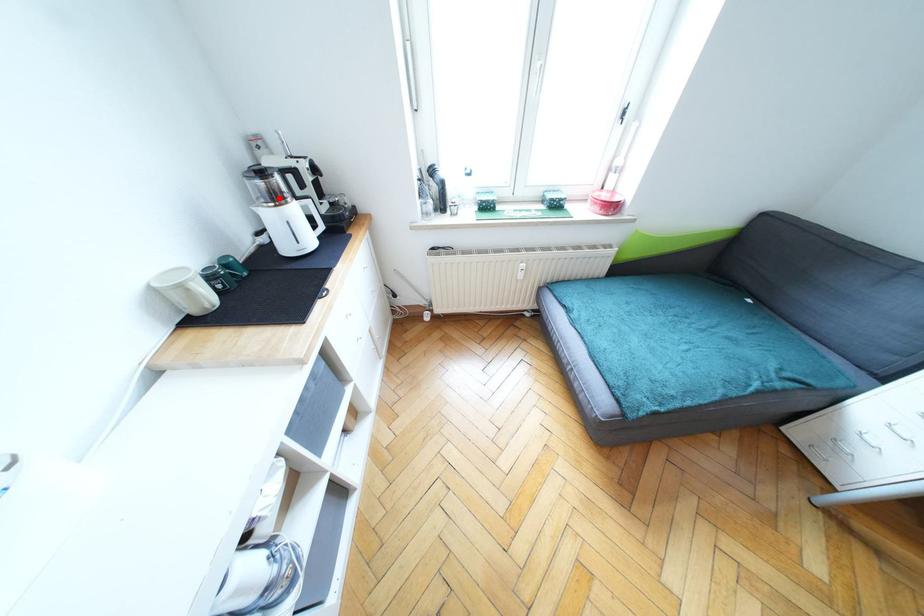
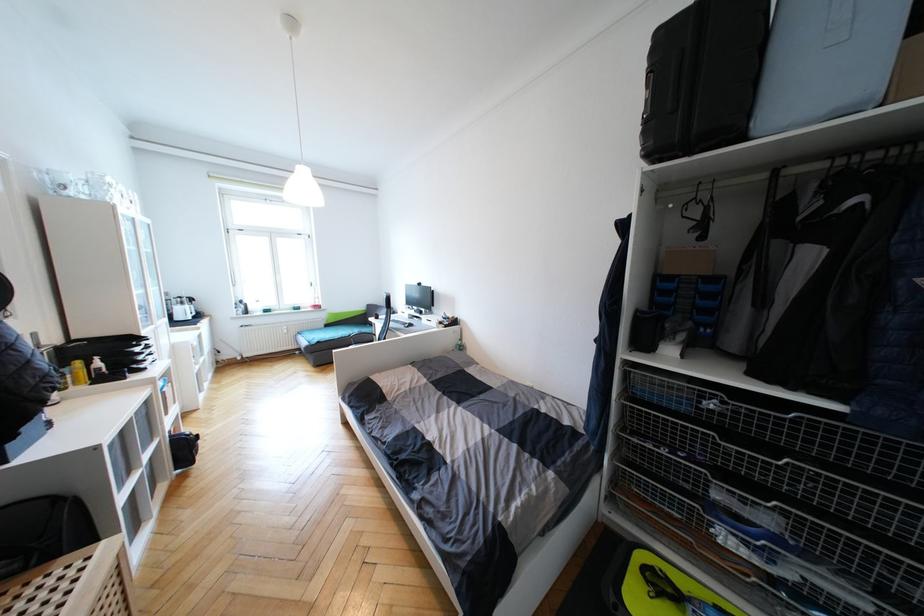
Where in the second image is the point corresponding to the highlighted location from the first image?

(186, 305)